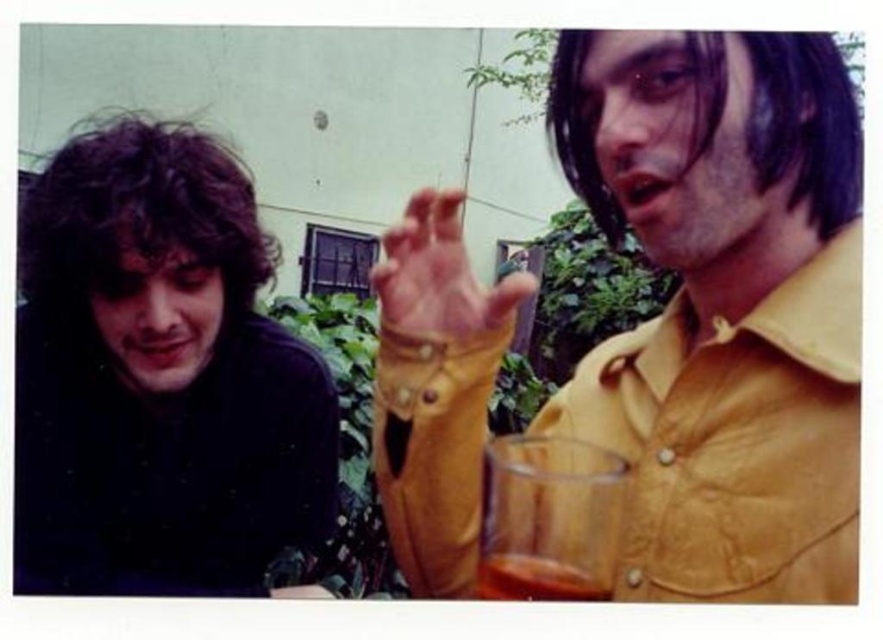
Question: Can you confirm if yellow leather shirt at upper right is positioned above translucent glass beverage at lower center?

Choices:
 (A) no
 (B) yes

Answer: (B)

Question: Does translucent glass at lower right have a greater width compared to leather glove at center?

Choices:
 (A) yes
 (B) no

Answer: (B)

Question: Considering the real-world distances, which object is farthest from the translucent glass at lower right?

Choices:
 (A) translucent glass beverage at lower center
 (B) dark matte shirt at left

Answer: (B)

Question: Which object is the closest to the translucent glass at lower right?

Choices:
 (A) yellow leather shirt at upper right
 (B) dark matte shirt at left
 (C) leather glove at center
 (D) translucent glass beverage at lower center

Answer: (D)

Question: Which of the following is the closest to the observer?

Choices:
 (A) translucent glass beverage at lower center
 (B) translucent glass at lower right

Answer: (B)

Question: Considering the relative positions of leather glove at center and translucent glass beverage at lower center in the image provided, where is leather glove at center located with respect to translucent glass beverage at lower center?

Choices:
 (A) below
 (B) above

Answer: (B)